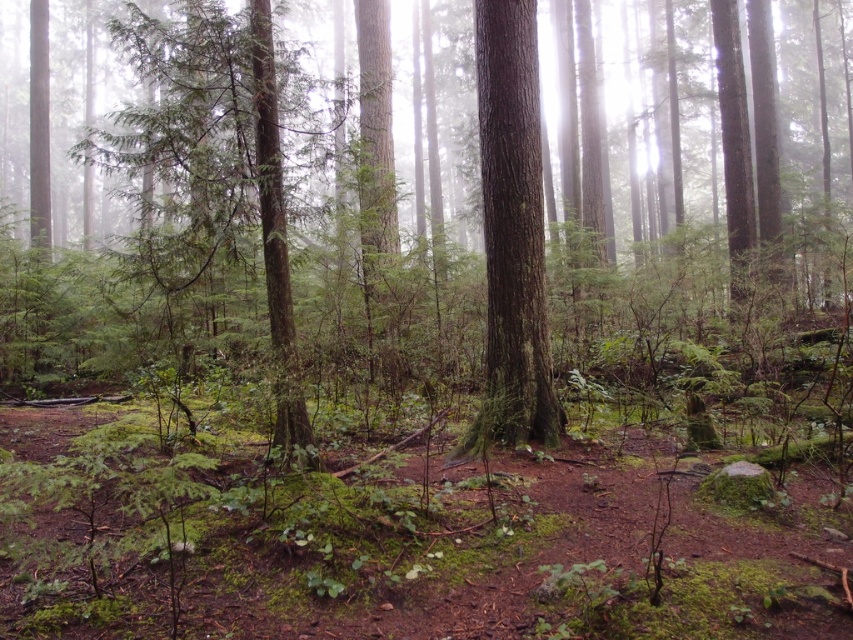
Question: Is green matte tree at center positioned before smooth brown tree trunk at center?

Choices:
 (A) yes
 (B) no

Answer: (A)

Question: Is green matte tree at center further to camera compared to smooth brown tree trunk at center?

Choices:
 (A) no
 (B) yes

Answer: (A)

Question: Which point is closer to the camera?

Choices:
 (A) (4, 118)
 (B) (535, 241)

Answer: (B)

Question: Is green matte tree at center positioned before smooth brown tree trunk at center?

Choices:
 (A) no
 (B) yes

Answer: (B)